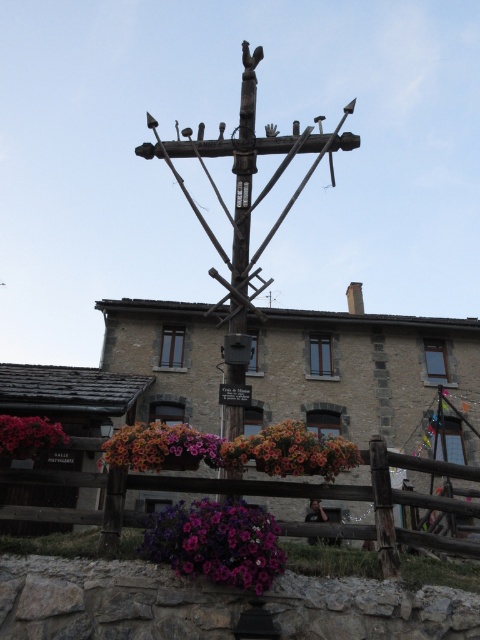
Who is more distant from viewer, (x=85, y=448) or (x=186, y=456)?

Positioned behind is point (x=85, y=448).

Which is more to the left, wooden at lower center or multicolored fabric flower at center?

From the viewer's perspective, multicolored fabric flower at center appears more on the left side.

Between point (58, 508) and point (158, 429), which one is positioned behind?

The point (58, 508) is behind.

This screenshot has height=640, width=480. In order to click on wooden at lower center in this screenshot , I will do `click(159, 490)`.

Is point (465, 508) closer to camera compared to point (228, 506)?

No.

Is wooden at lower center thinner than purple matte flower at center?

In fact, wooden at lower center might be wider than purple matte flower at center.

Measure the distance between point (x=288, y=534) and camera.

They are 29.42 feet apart.

Find the location of a particular element. The height and width of the screenshot is (640, 480). wooden at lower center is located at coordinates (159, 490).

Does wooden cross at center have a smaller size compared to vibrant floral basket at center?

Actually, wooden cross at center might be larger than vibrant floral basket at center.

Who is more distant from viewer, (245, 220) or (252, 438)?

The point (245, 220) is behind.

Identify the location of wooden cross at center. (252, 182).